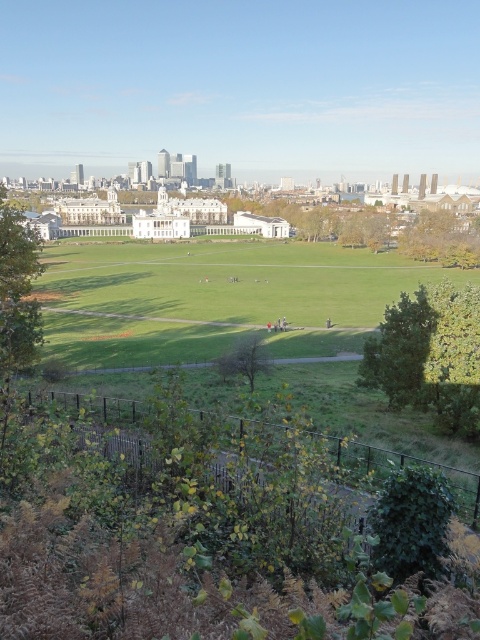
Is green grassy field at center to the left of green leafy tree at lower left from the viewer's perspective?

No, green grassy field at center is not to the left of green leafy tree at lower left.

Can you confirm if green grassy field at center is positioned to the right of green leafy tree at lower left?

Indeed, green grassy field at center is positioned on the right side of green leafy tree at lower left.

Is point (267, 252) less distant than point (12, 284)?

No, it is behind (12, 284).

What are the coordinates of `green grassy field at center` in the screenshot? It's located at (217, 298).

Can you confirm if green leafy tree at center-right is positioned below green leafy tree at upper right?

Yes, green leafy tree at center-right is below green leafy tree at upper right.

In the scene shown: Does green leafy tree at center-right have a smaller size compared to green leafy tree at upper right?

Yes, green leafy tree at center-right is smaller than green leafy tree at upper right.

Which is in front, point (436, 332) or point (453, 218)?

Positioned in front is point (436, 332).

Identify the location of green leafy tree at center-right. The width and height of the screenshot is (480, 640). (430, 356).

Between green grassy field at center and green leafy tree at upper right, which one appears on the left side from the viewer's perspective?

From the viewer's perspective, green grassy field at center appears more on the left side.

Who is positioned more to the right, green grassy field at center or green leafy tree at upper right?

Positioned to the right is green leafy tree at upper right.

What are the coordinates of `green grassy field at center` in the screenshot? It's located at (217, 298).

This screenshot has height=640, width=480. What are the coordinates of `green grassy field at center` in the screenshot? It's located at (217, 298).